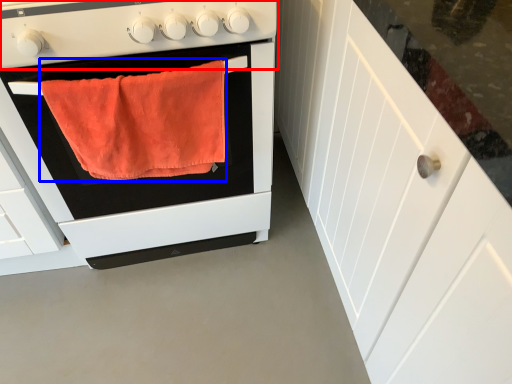
Question: Among these objects, which one is nearest to the camera, gas stove (highlighted by a red box) or bath towel (highlighted by a blue box)?

Choices:
 (A) gas stove
 (B) bath towel

Answer: (A)